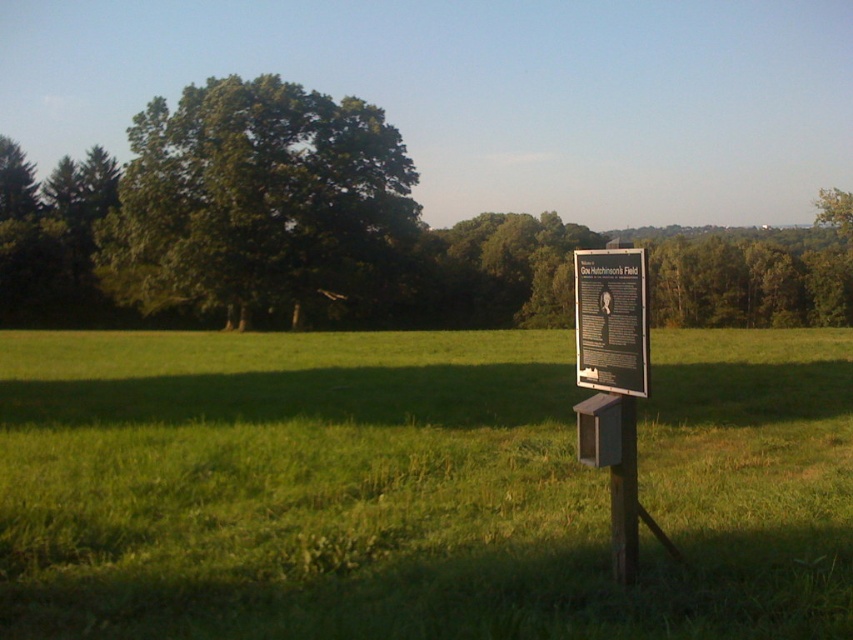
Is matte black sign at center above wooden post at center?

Yes, matte black sign at center is above wooden post at center.

Between matte black sign at center and wooden post at center, which one has more height?

With more height is wooden post at center.

Where is `matte black sign at center`? matte black sign at center is located at coordinates (611, 320).

Find the location of a particular element. The image size is (853, 640). matte black sign at center is located at coordinates (x=611, y=320).

Who is lower down, green leafy tree at upper left or wooden sign at center?

wooden sign at center

Is point (305, 170) positioned in front of point (611, 417)?

No.

Locate an element on the screen. The width and height of the screenshot is (853, 640). green leafy tree at upper left is located at coordinates (254, 198).

Does green leafy tree at upper left have a greater height compared to matte black sign at center?

Yes.

Is green leafy tree at upper left wider than matte black sign at center?

Yes.

Does point (276, 96) come behind point (595, 273)?

Yes, point (276, 96) is behind point (595, 273).

Where is `green leafy tree at upper left`? The width and height of the screenshot is (853, 640). green leafy tree at upper left is located at coordinates (254, 198).